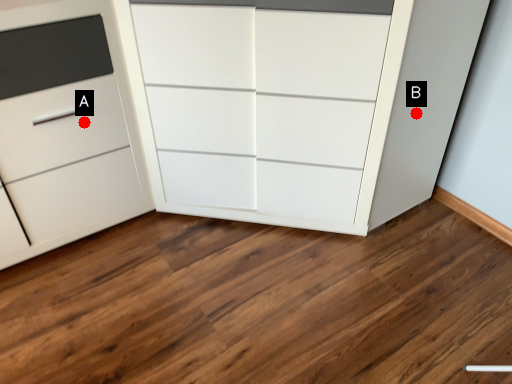
Question: Two points are circled on the image, labeled by A and B beside each circle. Which point appears closest to the camera in this image?

Choices:
 (A) A is closer
 (B) B is closer

Answer: (A)